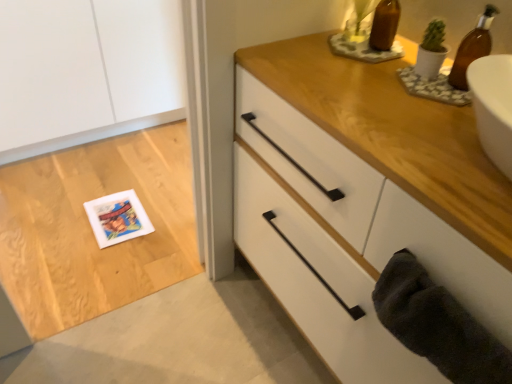
Question: Can you confirm if white matte chest of drawers at upper right is smaller than brown glass bottle at upper right?

Choices:
 (A) yes
 (B) no

Answer: (B)

Question: Is white matte chest of drawers at upper right positioned before brown glass bottle at upper right?

Choices:
 (A) no
 (B) yes

Answer: (B)

Question: Is white matte chest of drawers at upper right next to brown glass bottle at upper right?

Choices:
 (A) yes
 (B) no

Answer: (B)

Question: Is white matte chest of drawers at upper right not within brown glass bottle at upper right?

Choices:
 (A) no
 (B) yes

Answer: (B)

Question: From the image's perspective, is white matte chest of drawers at upper right beneath brown glass bottle at upper right?

Choices:
 (A) no
 (B) yes

Answer: (B)

Question: Is white matte chest of drawers at upper right taller than brown glass bottle at upper right?

Choices:
 (A) yes
 (B) no

Answer: (A)

Question: From a real-world perspective, does white matte chest of drawers at upper right stand above dark gray plush bath towel at lower right?

Choices:
 (A) no
 (B) yes

Answer: (A)

Question: Is dark gray plush bath towel at lower right surrounded by white matte chest of drawers at upper right?

Choices:
 (A) no
 (B) yes

Answer: (A)

Question: Considering the relative sizes of white matte chest of drawers at upper right and dark gray plush bath towel at lower right in the image provided, is white matte chest of drawers at upper right smaller than dark gray plush bath towel at lower right?

Choices:
 (A) yes
 (B) no

Answer: (B)

Question: Is white matte chest of drawers at upper right with dark gray plush bath towel at lower right?

Choices:
 (A) yes
 (B) no

Answer: (B)

Question: Can you confirm if white matte chest of drawers at upper right is positioned to the left of dark gray plush bath towel at lower right?

Choices:
 (A) no
 (B) yes

Answer: (A)

Question: From the image's perspective, does white matte chest of drawers at upper right appear higher than dark gray plush bath towel at lower right?

Choices:
 (A) yes
 (B) no

Answer: (A)

Question: Considering the relative sizes of white matte postcard at lower left and white matte chest of drawers at upper right in the image provided, is white matte postcard at lower left shorter than white matte chest of drawers at upper right?

Choices:
 (A) yes
 (B) no

Answer: (A)